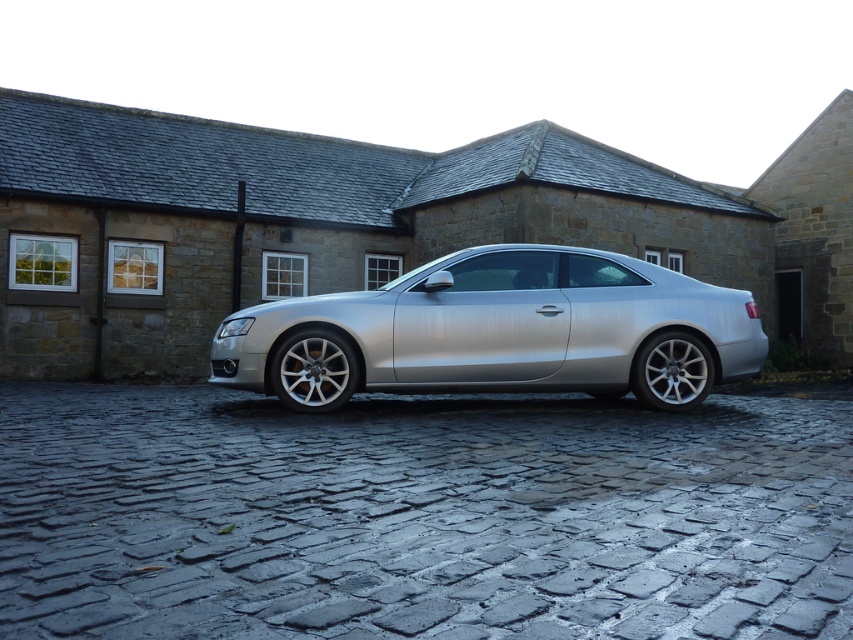
Question: Does dark gray cobblestone driveway at center have a larger size compared to silver metallic car at center?

Choices:
 (A) yes
 (B) no

Answer: (B)

Question: Which object appears closest to the camera in this image?

Choices:
 (A) dark gray cobblestone driveway at center
 (B) silver metallic car at center

Answer: (A)

Question: Can you confirm if dark gray cobblestone driveway at center is thinner than silver metallic car at center?

Choices:
 (A) no
 (B) yes

Answer: (B)

Question: Among these objects, which one is nearest to the camera?

Choices:
 (A) dark gray cobblestone driveway at center
 (B) silver metallic car at center

Answer: (A)

Question: Which point is farther to the camera?

Choices:
 (A) (653, 326)
 (B) (525, 544)

Answer: (A)

Question: Does dark gray cobblestone driveway at center lie behind silver metallic car at center?

Choices:
 (A) no
 (B) yes

Answer: (A)